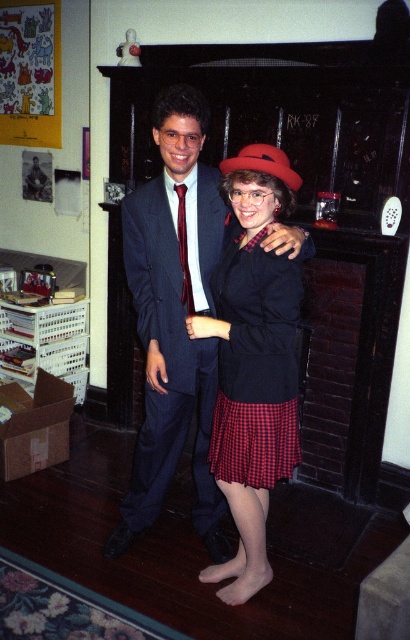
Question: Which object is positioned farthest from the dark blue wool suit at center?

Choices:
 (A) matte black suit at center
 (B) red checkered skirt at center
 (C) burgundy silk tie at center

Answer: (C)

Question: Considering the relative positions of matte black suit at center and dark blue wool suit at center in the image provided, where is matte black suit at center located with respect to dark blue wool suit at center?

Choices:
 (A) below
 (B) above

Answer: (B)

Question: Is dark blue wool suit at center above burgundy silk tie at center?

Choices:
 (A) yes
 (B) no

Answer: (B)

Question: Which is nearer to the burgundy silk tie at center?

Choices:
 (A) red checkered skirt at center
 (B) matte black suit at center

Answer: (B)

Question: Can you confirm if matte black suit at center is positioned above red checkered skirt at center?

Choices:
 (A) no
 (B) yes

Answer: (B)

Question: Which object is closer to the camera taking this photo?

Choices:
 (A) matte black suit at center
 (B) burgundy silk tie at center

Answer: (A)